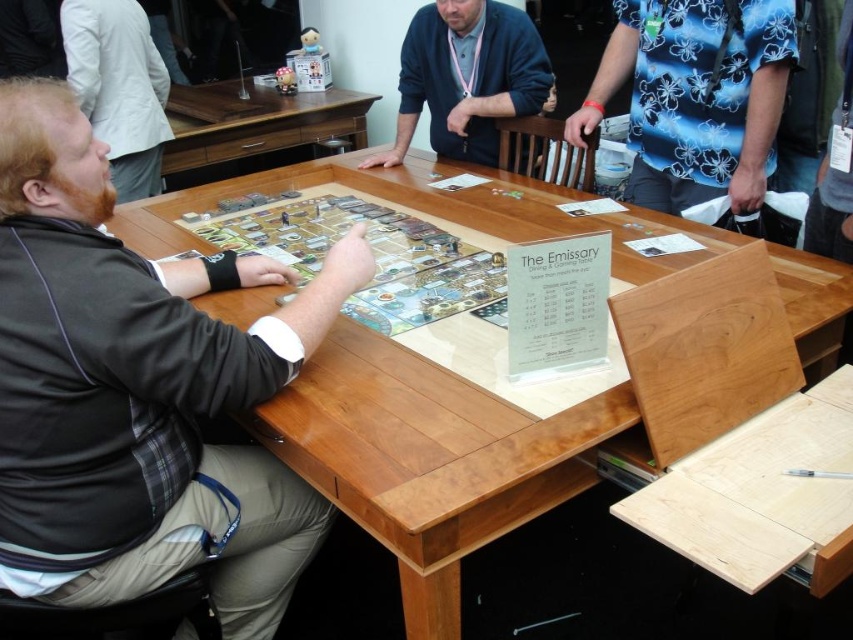
Who is more forward, (761, 26) or (161, 68)?

Point (761, 26) is in front.

Identify the location of blue floral shirt at upper right. The image size is (853, 640). (695, 97).

The width and height of the screenshot is (853, 640). What do you see at coordinates (695, 97) in the screenshot?
I see `blue floral shirt at upper right` at bounding box center [695, 97].

This screenshot has width=853, height=640. I want to click on blue floral shirt at upper right, so click(x=695, y=97).

Which is below, blue floral shirt at upper right or brown wood table at upper center?

blue floral shirt at upper right is lower down.

Where is `blue floral shirt at upper right`? blue floral shirt at upper right is located at coordinates tap(695, 97).

Find the location of a particular element. Image resolution: width=853 pixels, height=640 pixels. blue floral shirt at upper right is located at coordinates (695, 97).

Can you confirm if dark gray jacket at left is shorter than dark blue sweater at center?

In fact, dark gray jacket at left may be taller than dark blue sweater at center.

Is dark gray jacket at left thinner than dark blue sweater at center?

Yes, dark gray jacket at left is thinner than dark blue sweater at center.

Between point (317, 536) and point (473, 56), which one is positioned behind?

Positioned behind is point (473, 56).

I want to click on dark gray jacket at left, so click(x=138, y=392).